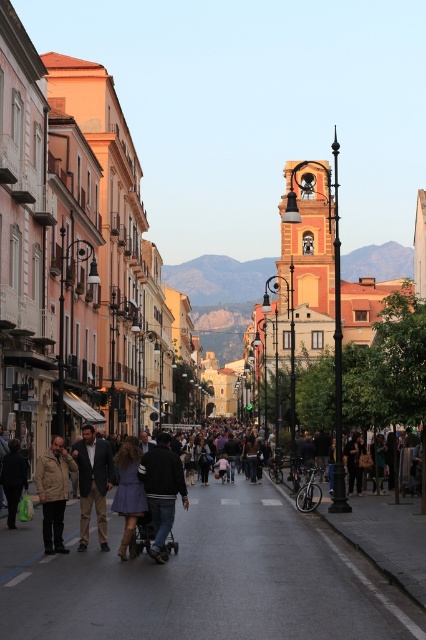
Question: Is gold metallic bell tower at center smaller than purple matte dress at center?

Choices:
 (A) yes
 (B) no

Answer: (B)

Question: Considering the real-world distances, which object is farthest from the khaki cotton pants at center?

Choices:
 (A) gold metallic bell tower at center
 (B) purple matte dress at center

Answer: (A)

Question: Which object is positioned closest to the purple matte dress at center?

Choices:
 (A) dark blue jeans at center
 (B) khaki cotton jacket at center
 (C) khaki cotton pants at center
 (D) gold metallic bell tower at center

Answer: (A)

Question: Does khaki cotton pants at center come in front of khaki cotton jacket at center?

Choices:
 (A) no
 (B) yes

Answer: (A)

Question: Which point is closer to the camera?

Choices:
 (A) (328, 259)
 (B) (126, 547)
 (C) (161, 492)
 (D) (362, 524)

Answer: (C)

Question: From the image, what is the correct spatial relationship of gold metallic bell tower at center in relation to dark blue dress at center?

Choices:
 (A) below
 (B) above

Answer: (B)